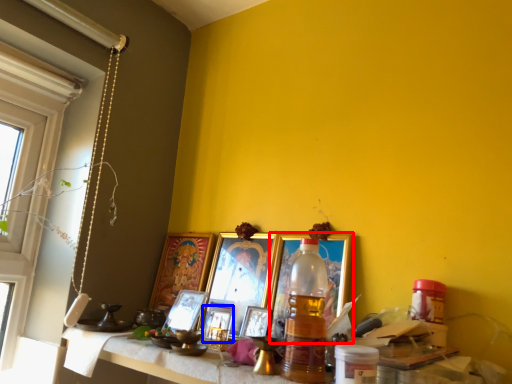
Question: Which of the following is the farthest to the observer, picture frame (highlighted by a red box) or picture frame (highlighted by a blue box)?

Choices:
 (A) picture frame
 (B) picture frame

Answer: (B)